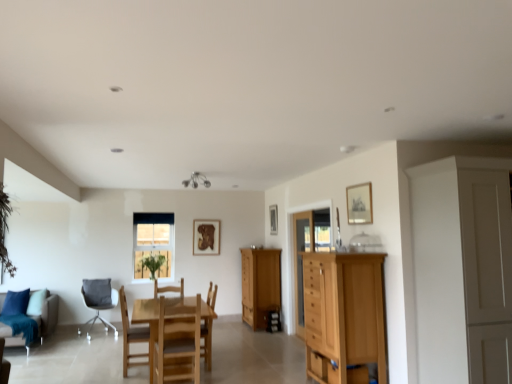
Question: Considering the positions of wooden chair at center, the 2th chair positioned from the right, and transparent glass cabinet at center, which is counted as the first glass door, starting from the left, in the image, is wooden chair at center, the 2th chair positioned from the right, taller or shorter than transparent glass cabinet at center, which is counted as the first glass door, starting from the left,?

Choices:
 (A) tall
 (B) short

Answer: (B)

Question: Considering the positions of wooden chair at center, the 4th chair when ordered from back to front, and transparent glass cabinet at center, the second glass door positioned from the right, in the image, is wooden chair at center, the 4th chair when ordered from back to front, bigger or smaller than transparent glass cabinet at center, the second glass door positioned from the right,?

Choices:
 (A) small
 (B) big

Answer: (B)

Question: Which object is positioned closest to the wooden picture frame at center, marked as the 3th picture frame in a right-to-left arrangement?

Choices:
 (A) teal fabric couch at lower left
 (B) wooden picture frame at upper right, the first picture frame positioned from the front
 (C) wooden chair at center, the 4th chair when ordered from back to front
 (D) wooden cabinet at center
 (E) green leafy plant at center

Answer: (E)

Question: Which is nearer to the wooden chair at center, the 3th chair positioned from the right?

Choices:
 (A) green leafy plant at center
 (B) wooden chair at center, the fourth chair in the left-to-right sequence
 (C) wooden frame at center
 (D) light brown wood chest of drawers at right
 (E) transparent glass cabinet at center, which is counted as the first glass door, starting from the left

Answer: (B)